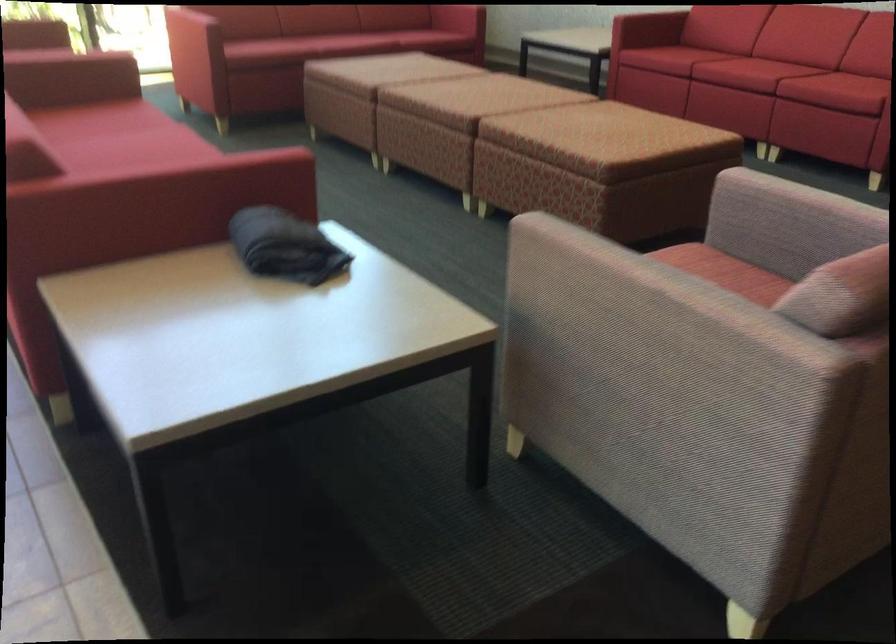
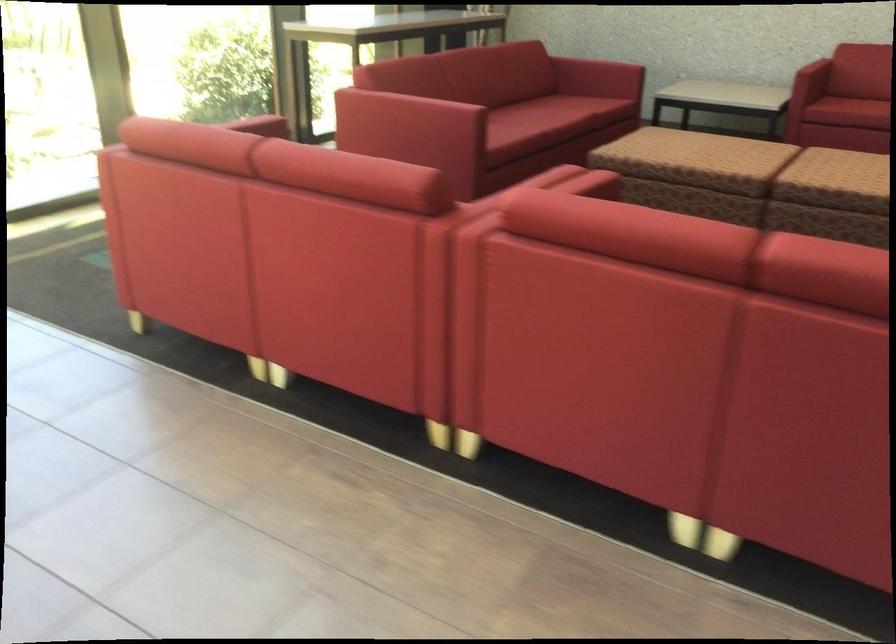
The images are taken continuously from a first-person perspective. In which direction is your viewpoint rotating?

The camera rotated toward right-down.